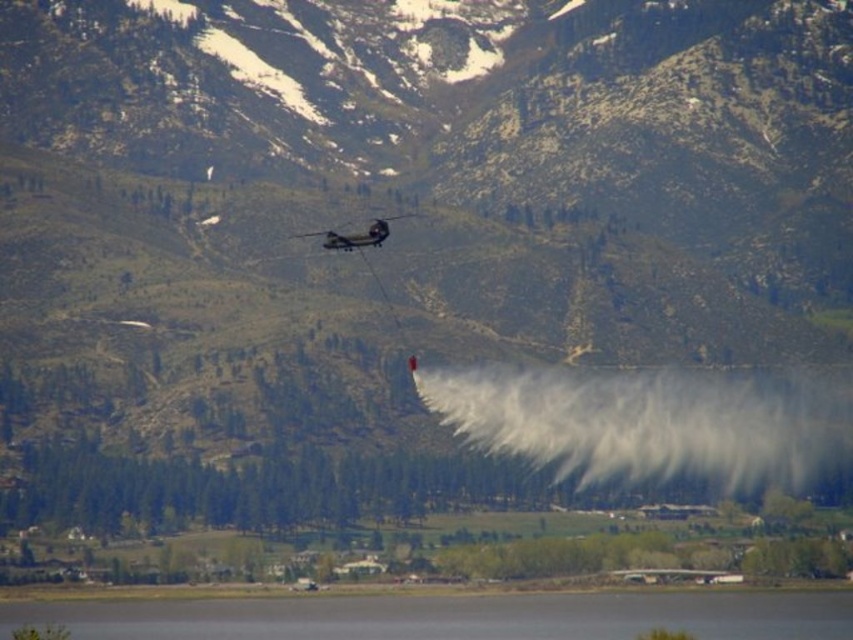
Can you confirm if transparent water at lower center is bigger than metallic gray helicopter at center?

Yes.

Is point (407, 616) more distant than point (379, 224)?

Yes, it is behind point (379, 224).

In order to click on transparent water at lower center in this screenshot , I will do `click(451, 616)`.